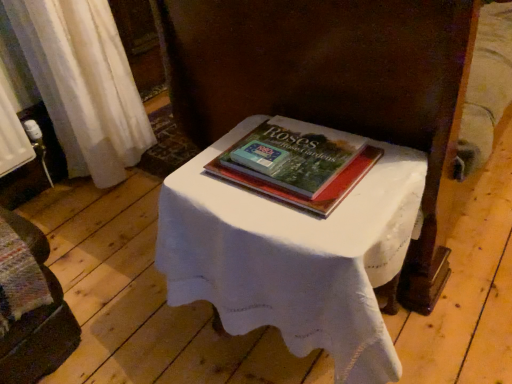
In order to click on free space above white cloth-covered table at center (from a real-world perspective) in this screenshot , I will do `click(286, 199)`.